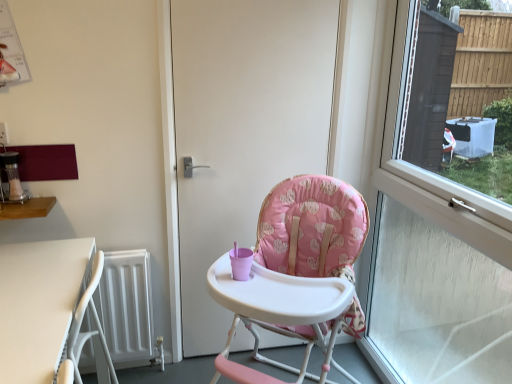
Question: From the image's perspective, is pink fabric highchair at center on top of white matte door at center?

Choices:
 (A) yes
 (B) no

Answer: (B)

Question: From the image's perspective, does pink fabric highchair at center appear lower than white matte door at center?

Choices:
 (A) no
 (B) yes

Answer: (B)

Question: Can you confirm if pink fabric highchair at center is positioned to the right of white matte door at center?

Choices:
 (A) no
 (B) yes

Answer: (B)

Question: Is pink fabric highchair at center oriented away from white matte door at center?

Choices:
 (A) no
 (B) yes

Answer: (A)

Question: Is pink fabric highchair at center closer to the viewer compared to white matte door at center?

Choices:
 (A) yes
 (B) no

Answer: (A)

Question: Based on their positions, is transparent glass window at right located to the left or right of white plastic table at lower left, the 1th table ordered from the bottom?

Choices:
 (A) right
 (B) left

Answer: (A)

Question: Do you think transparent glass window at right is within white plastic table at lower left, the 2th table when ordered from top to bottom, or outside of it?

Choices:
 (A) outside
 (B) inside

Answer: (A)

Question: In terms of size, does transparent glass window at right appear bigger or smaller than white plastic table at lower left, the 1th table ordered from the bottom?

Choices:
 (A) big
 (B) small

Answer: (A)

Question: Does point (497, 369) appear closer or farther from the camera than point (13, 268)?

Choices:
 (A) closer
 (B) farther

Answer: (B)

Question: From a real-world perspective, is wooden table at left, the 2th table when ordered from bottom to top, above or below transparent glass window at right?

Choices:
 (A) above
 (B) below

Answer: (A)

Question: Looking at the image, does wooden table at left, the 2th table when ordered from bottom to top, seem bigger or smaller compared to transparent glass window at right?

Choices:
 (A) small
 (B) big

Answer: (A)

Question: Is wooden table at left, which ranks as the first table in top-to-bottom order, wider or thinner than transparent glass window at right?

Choices:
 (A) wide
 (B) thin

Answer: (A)

Question: Is wooden table at left, the 2th table when ordered from bottom to top, inside the boundaries of transparent glass window at right, or outside?

Choices:
 (A) inside
 (B) outside

Answer: (B)

Question: In the image, is pink fabric highchair at center positioned in front of or behind white matte door at center?

Choices:
 (A) front
 (B) behind

Answer: (A)

Question: From a real-world perspective, relative to white matte door at center, is pink fabric highchair at center vertically above or below?

Choices:
 (A) above
 (B) below

Answer: (B)